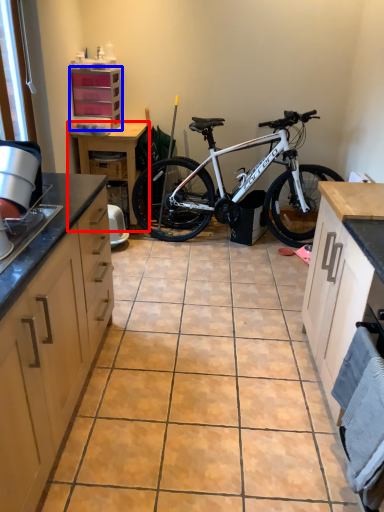
Question: Which point is further to the camera, table (highlighted by a red box) or cabinetry (highlighted by a blue box)?

Choices:
 (A) table
 (B) cabinetry

Answer: (A)